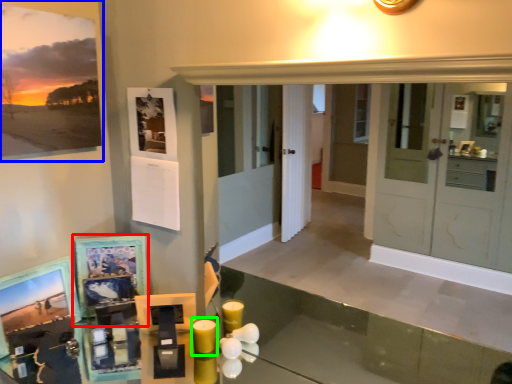
Question: Based on their relative distances, which object is nearer to picture frame (highlighted by a red box)? Choose from picture frame (highlighted by a blue box) and candle (highlighted by a green box).

Choices:
 (A) picture frame
 (B) candle

Answer: (B)